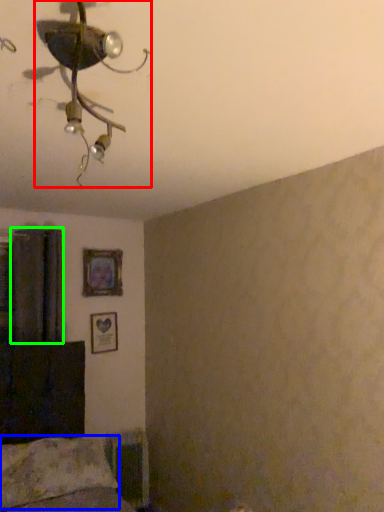
Question: Which is nearer to the lamp (highlighted by a red box)? pillow (highlighted by a blue box) or curtain (highlighted by a green box).

Choices:
 (A) pillow
 (B) curtain

Answer: (B)